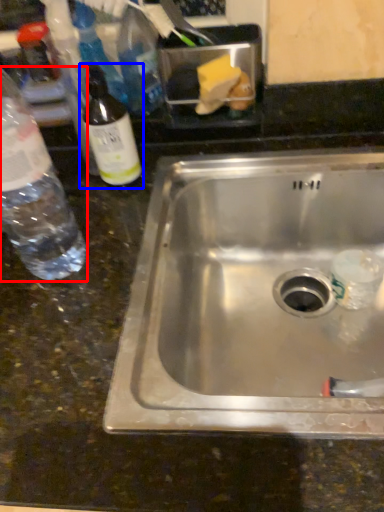
Question: Which point is closer to the camera, bottle (highlighted by a red box) or bottle (highlighted by a blue box)?

Choices:
 (A) bottle
 (B) bottle

Answer: (A)